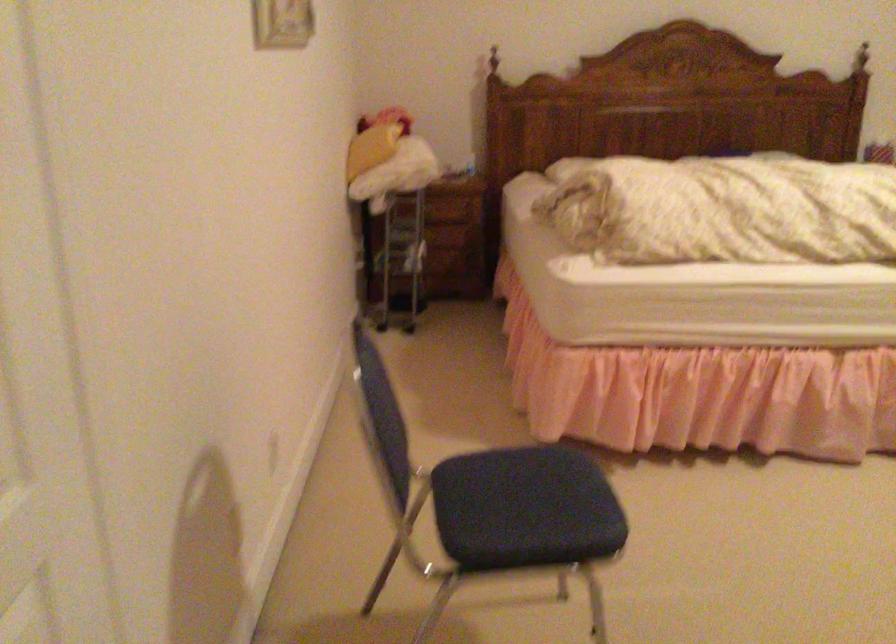
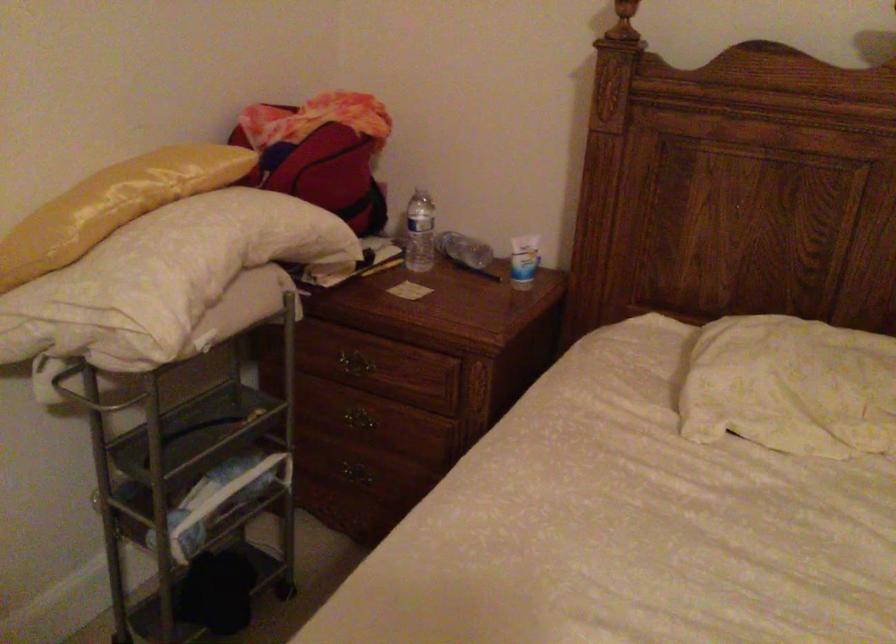
Where in the second image is the point corresponding to (421,147) from the first image?

(164, 278)